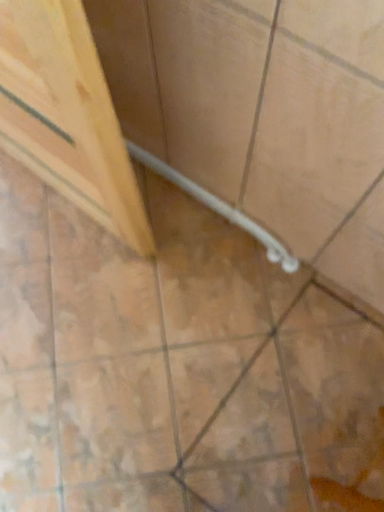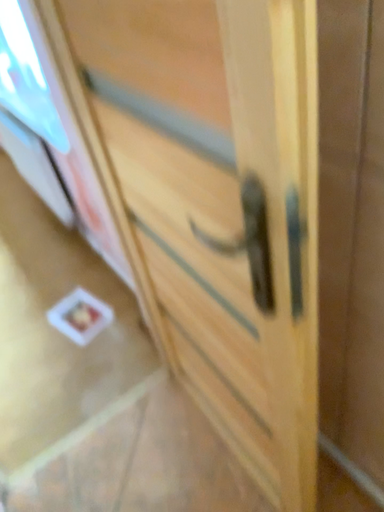
Question: Which way did the camera rotate in the video?

Choices:
 (A) rotated left
 (B) rotated right

Answer: (A)